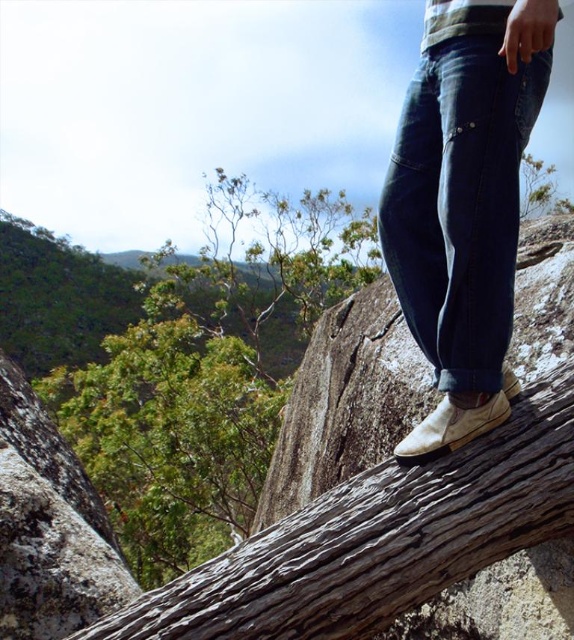
Question: From the image, what is the correct spatial relationship of green leafy tree at center in relation to dark blue denim jeans at center?

Choices:
 (A) below
 (B) above

Answer: (A)

Question: Which point is farther to the camera?

Choices:
 (A) (176, 444)
 (B) (444, 227)

Answer: (A)

Question: Considering the relative positions of green leafy tree at center and dark blue denim jeans at center in the image provided, where is green leafy tree at center located with respect to dark blue denim jeans at center?

Choices:
 (A) below
 (B) above

Answer: (A)

Question: Among these objects, which one is farthest from the camera?

Choices:
 (A) green leafy tree at center
 (B) dark blue denim jeans at center

Answer: (A)

Question: Can you confirm if green leafy tree at center is positioned above dark blue denim jeans at center?

Choices:
 (A) no
 (B) yes

Answer: (A)